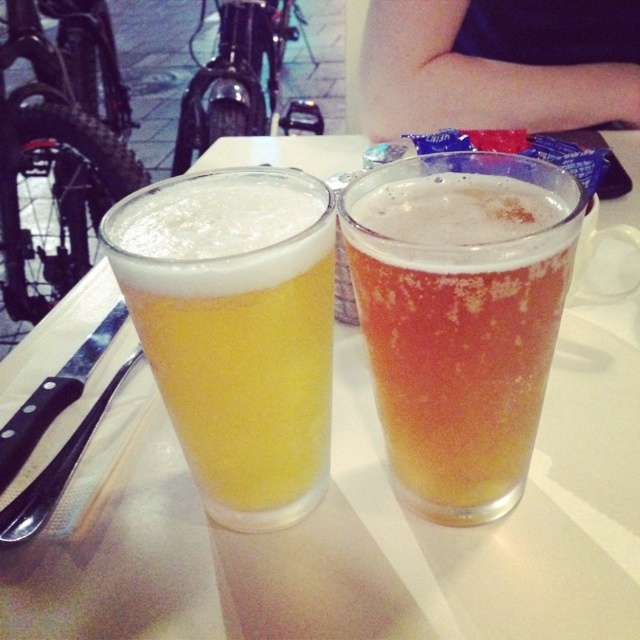
You are a waiter at a outdoor cafe and you need to place a new plate between the translucent glass at center and the black plastic knife at left. Is there enough space between them to fit the plate?

The translucent glass at center is located above the black plastic knife at left, so placing a plate between them would require vertical space. Since the question mentions placing the plate between them horizontally, there might not be enough space if they are vertically aligned. However, without specific measurements, it is difficult to determine.